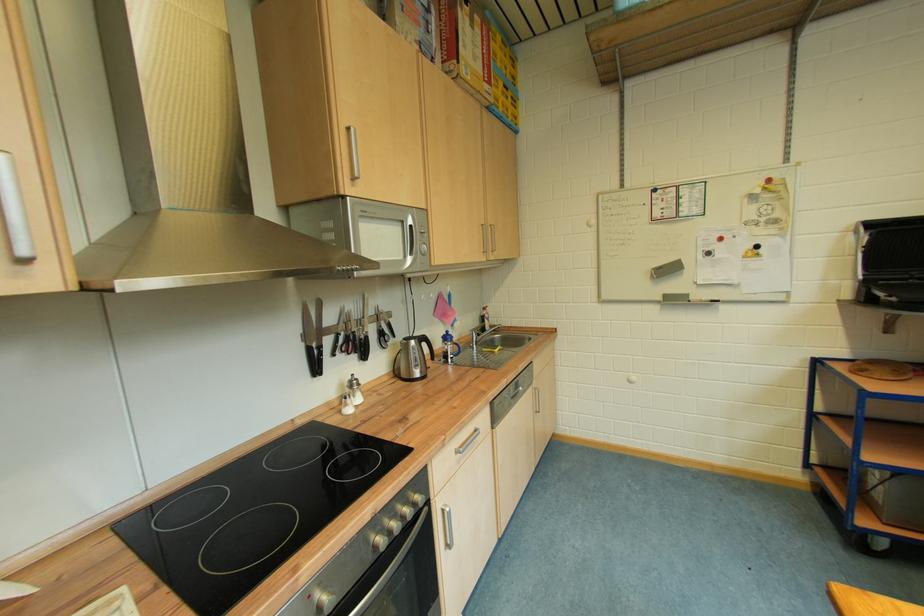
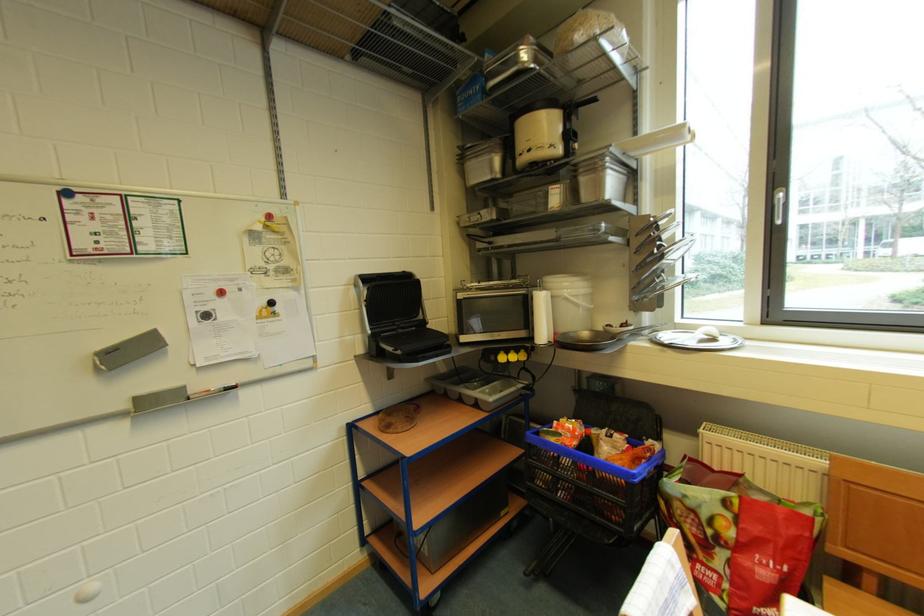
Question: Based on the continuous images, in which direction is the camera rotating? Reply with the corresponding letter.

Choices:
 (A) Left
 (B) Right
 (C) Up
 (D) Down

Answer: (B)